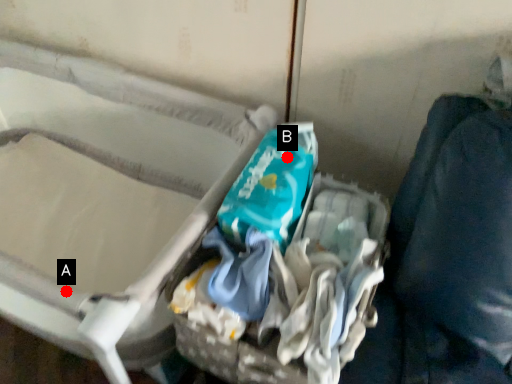
Question: Two points are circled on the image, labeled by A and B beside each circle. Among these points, which one is nearest to the camera?

Choices:
 (A) A is closer
 (B) B is closer

Answer: (A)